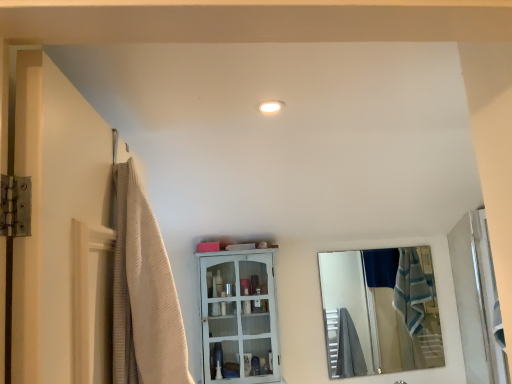
Image resolution: width=512 pixels, height=384 pixels. What do you see at coordinates (378, 312) in the screenshot? I see `silver reflective mirror at right` at bounding box center [378, 312].

What do you see at coordinates (144, 294) in the screenshot? I see `beige textured shower curtain at left` at bounding box center [144, 294].

What is the approximate width of white glossy light fixture at upper center?

white glossy light fixture at upper center is 3.62 inches wide.

The image size is (512, 384). Find the location of `white glossy door at right`. white glossy door at right is located at coordinates (476, 300).

Identify the location of silver reflective mirror at right. (378, 312).

How many degrees apart are the facing directions of white glossy door at right and beige textured shower curtain at left?

The angle between the facing direction of white glossy door at right and the facing direction of beige textured shower curtain at left is 180 degrees.

Considering the relative sizes of white glossy door at right and beige textured shower curtain at left in the image provided, is white glossy door at right thinner than beige textured shower curtain at left?

No.

Who is more distant, white glossy door at right or beige textured shower curtain at left?

white glossy door at right.

Which is in front, point (484, 358) or point (139, 376)?

The point (139, 376) is more forward.

In the scene shown: Is white painted wood cabinet at center not close to silver reflective mirror at right?

That's right, there is a large distance between white painted wood cabinet at center and silver reflective mirror at right.

Does white painted wood cabinet at center have a smaller size compared to silver reflective mirror at right?

No, white painted wood cabinet at center is not smaller than silver reflective mirror at right.

Considering the relative positions of white painted wood cabinet at center and silver reflective mirror at right in the image provided, is white painted wood cabinet at center behind silver reflective mirror at right?

No, white painted wood cabinet at center is closer to the viewer.

From the image's perspective, is white painted wood cabinet at center located above silver reflective mirror at right?

Yes, from the image's perspective, white painted wood cabinet at center is above silver reflective mirror at right.

From a real-world perspective, between silver reflective mirror at right and beige textured shower curtain at left, who is vertically higher?

beige textured shower curtain at left is physically above.

Does silver reflective mirror at right appear on the right side of beige textured shower curtain at left?

Yes.

Between silver reflective mirror at right and beige textured shower curtain at left, which one has larger size?

beige textured shower curtain at left is bigger.

Is silver reflective mirror at right inside or outside of beige textured shower curtain at left?

silver reflective mirror at right is not enclosed by beige textured shower curtain at left.

From a real-world perspective, which object rests below the other?

white painted wood cabinet at center, from a real-world perspective.

Looking at this image, would you consider beige textured shower curtain at left to be distant from white painted wood cabinet at center?

Yes.

Between beige textured shower curtain at left and white painted wood cabinet at center, which one has smaller width?

white painted wood cabinet at center.

Is white painted wood cabinet at center a part of beige textured shower curtain at left?

No, white painted wood cabinet at center is located outside of beige textured shower curtain at left.

In terms of height, does white painted wood cabinet at center look taller or shorter compared to white glossy light fixture at upper center?

In the image, white painted wood cabinet at center appears to be taller than white glossy light fixture at upper center.

From a real-world perspective, is white painted wood cabinet at center over white glossy light fixture at upper center?

No.

Consider the image. Would you say white painted wood cabinet at center is a long distance from white glossy light fixture at upper center?

white painted wood cabinet at center is positioned a significant distance from white glossy light fixture at upper center.

Would you say white painted wood cabinet at center contains white glossy light fixture at upper center?

That's incorrect, white glossy light fixture at upper center is not inside white painted wood cabinet at center.

Can you tell me how much silver reflective mirror at right and white painted wood cabinet at center differ in facing direction?

The facing directions of silver reflective mirror at right and white painted wood cabinet at center are 0.768 degrees apart.

From a real-world perspective, is silver reflective mirror at right beneath white painted wood cabinet at center?

Yes.

Considering the sizes of objects silver reflective mirror at right and white painted wood cabinet at center in the image provided, who is wider, silver reflective mirror at right or white painted wood cabinet at center?

Wider between the two is white painted wood cabinet at center.

Which is correct: silver reflective mirror at right is inside white painted wood cabinet at center, or outside of it?

silver reflective mirror at right is not enclosed by white painted wood cabinet at center.

From a real-world perspective, is white painted wood cabinet at center on top of beige textured shower curtain at left?

Incorrect, from a real-world perspective, white painted wood cabinet at center is lower than beige textured shower curtain at left.

Is beige textured shower curtain at left surrounded by white painted wood cabinet at center?

No, beige textured shower curtain at left is not inside white painted wood cabinet at center.

Does point (257, 294) appear closer or farther from the camera than point (147, 328)?

Clearly, point (257, 294) is more distant from the camera than point (147, 328).

Considering the sizes of white painted wood cabinet at center and beige textured shower curtain at left in the image, is white painted wood cabinet at center taller or shorter than beige textured shower curtain at left?

In the image, white painted wood cabinet at center appears to be taller than beige textured shower curtain at left.

Locate an element on the screen. This screenshot has width=512, height=384. shower curtain to the left of white glossy door at right is located at coordinates (144, 294).

You are a GUI agent. You are given a task and a screenshot of the screen. Output one action in this format:
    pyautogui.click(x=<x>, y=<y>)
    Task: Click on the mirror that appears on the right of white painted wood cabinet at center
    Image resolution: width=512 pixels, height=384 pixels.
    Given the screenshot: What is the action you would take?
    pyautogui.click(x=378, y=312)

Considering their positions, is white glossy door at right positioned further to beige textured shower curtain at left than silver reflective mirror at right?

silver reflective mirror at right is positioned further to the anchor beige textured shower curtain at left.

Which object lies nearer to the anchor point white glossy door at right, white painted wood cabinet at center or beige textured shower curtain at left?

The object closer to white glossy door at right is white painted wood cabinet at center.

In the scene shown: Estimate the real-world distances between objects in this image. Which object is closer to silver reflective mirror at right, white glossy light fixture at upper center or white glossy door at right?

Based on the image, white glossy door at right appears to be nearer to silver reflective mirror at right.

Considering their positions, is beige textured shower curtain at left positioned closer to silver reflective mirror at right than white glossy door at right?

The object closer to silver reflective mirror at right is white glossy door at right.

Based on their spatial positions, is white glossy light fixture at upper center or beige textured shower curtain at left closer to white painted wood cabinet at center?

white glossy light fixture at upper center.

Which object lies further to the anchor point white glossy light fixture at upper center, white painted wood cabinet at center or white glossy door at right?

Based on the image, white glossy door at right appears to be further to white glossy light fixture at upper center.

From the picture: Considering their positions, is beige textured shower curtain at left positioned further to white glossy light fixture at upper center than white painted wood cabinet at center?

white painted wood cabinet at center is positioned further to the anchor white glossy light fixture at upper center.

Which object lies nearer to the anchor point white glossy light fixture at upper center, white painted wood cabinet at center or silver reflective mirror at right?

white painted wood cabinet at center.

Identify the location of cabinetry between white glossy light fixture at upper center and silver reflective mirror at right from front to back. Image resolution: width=512 pixels, height=384 pixels. (239, 317).

Identify the location of mirror between white painted wood cabinet at center and white glossy door at right in the horizontal direction. The height and width of the screenshot is (384, 512). (378, 312).

At what (x,y) coordinates should I click in order to perform the action: click on cabinetry located between beige textured shower curtain at left and silver reflective mirror at right in the depth direction. Please return your answer as a coordinate pair (x, y). The height and width of the screenshot is (384, 512). Looking at the image, I should click on (239, 317).

This screenshot has width=512, height=384. I want to click on light fixture between white painted wood cabinet at center and white glossy door at right, so click(x=271, y=106).